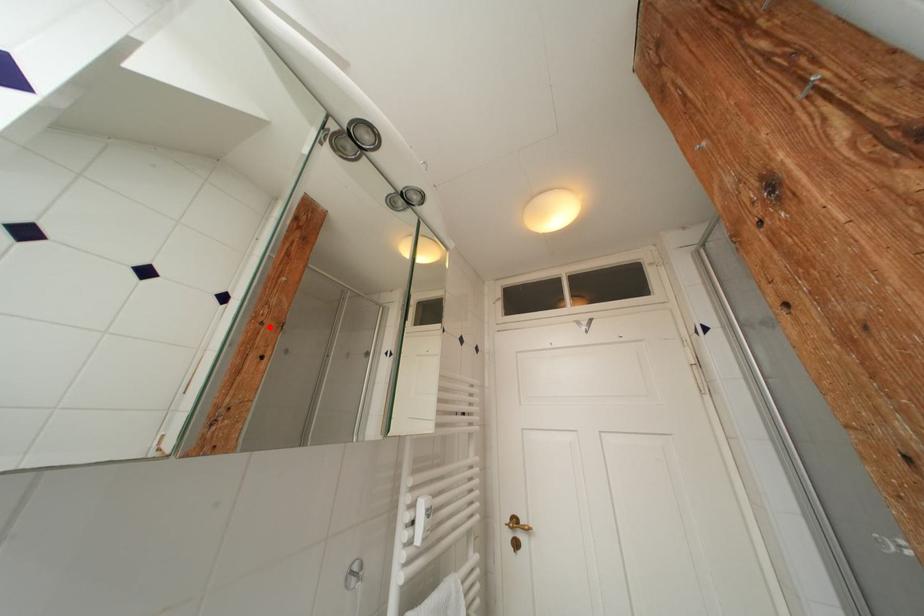
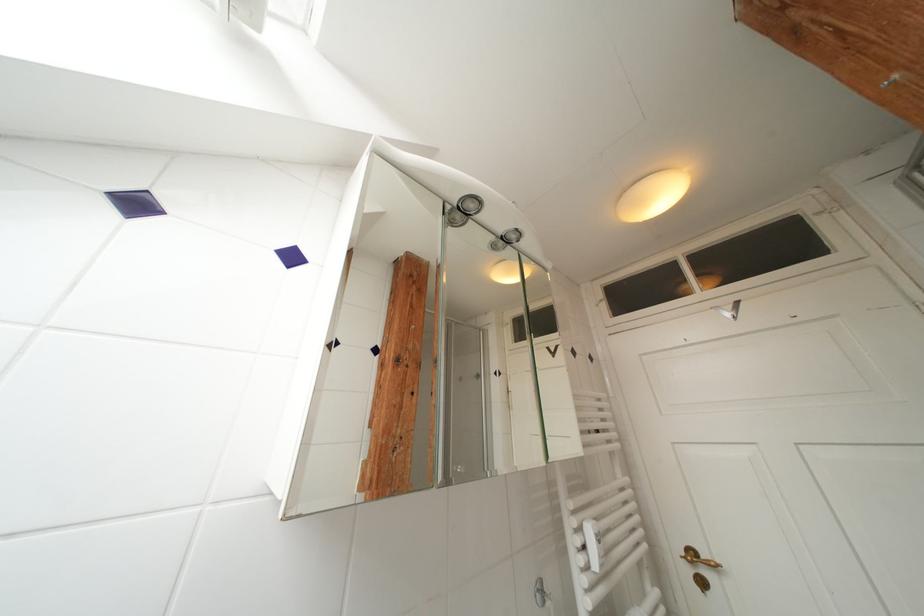
Question: I am providing you with two images of the same scene from different viewpoints. A red point is marked on the first image. At the location where the point appears in image 1, is it still visible in image 2?

Choices:
 (A) Yes
 (B) No

Answer: (A)